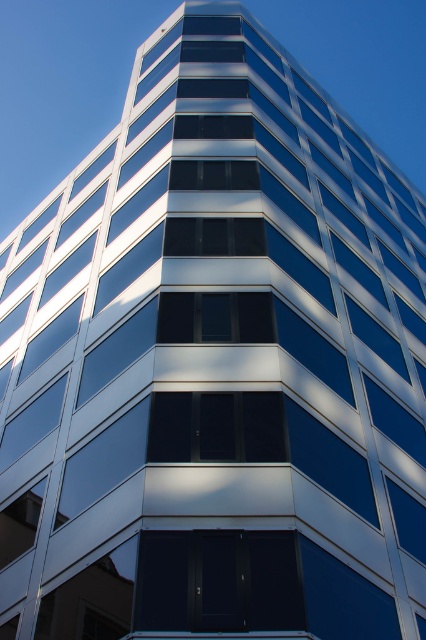
Does dark glass door at center have a smaller size compared to black glass window at center?

No, dark glass door at center is not smaller than black glass window at center.

What do you see at coordinates (218, 580) in the screenshot?
I see `dark glass door at center` at bounding box center [218, 580].

Locate an element on the screen. dark glass door at center is located at coordinates (218, 580).